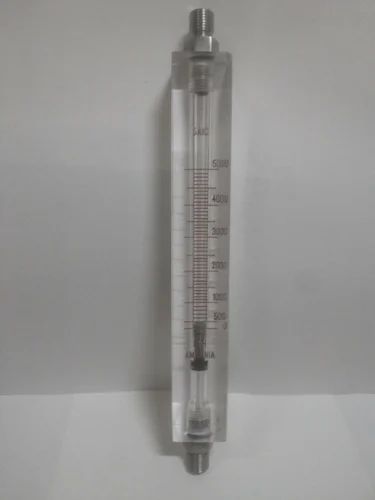
You are a GUI agent. You are given a task and a screenshot of the screen. Output one action in this format:
    pyautogui.click(x=<x>, y=<y>)
    Task: Click on the wall
    The width and height of the screenshot is (375, 500).
    Given the screenshot: What is the action you would take?
    pyautogui.click(x=277, y=130)